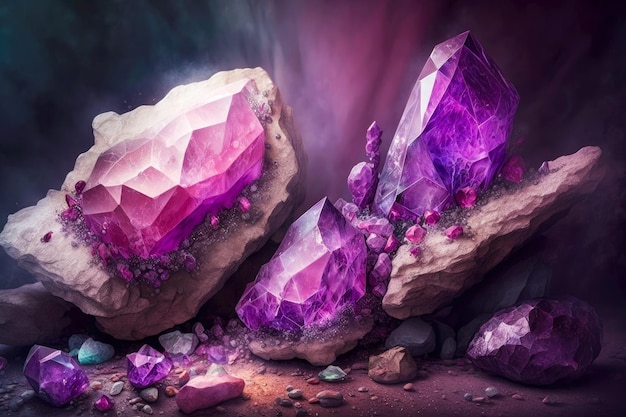
You are a GUI agent. You are given a task and a screenshot of the screen. Output one action in this format:
    pyautogui.click(x=<x>, y=<y>)
    Task: Click on the artwork
    The image size is (626, 417).
    Given the screenshot: What is the action you would take?
    pyautogui.click(x=320, y=199)